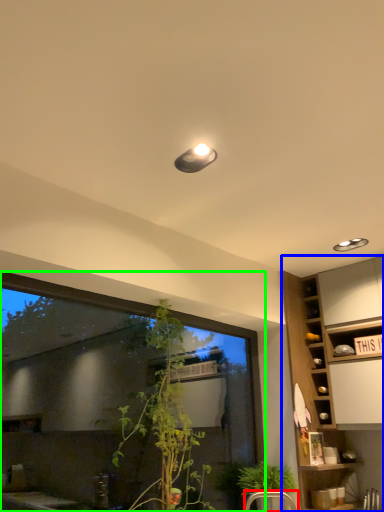
Question: Which is nearer to the armchair (highlighted by a red box)? cabinetry (highlighted by a blue box) or window (highlighted by a green box).

Choices:
 (A) cabinetry
 (B) window

Answer: (B)